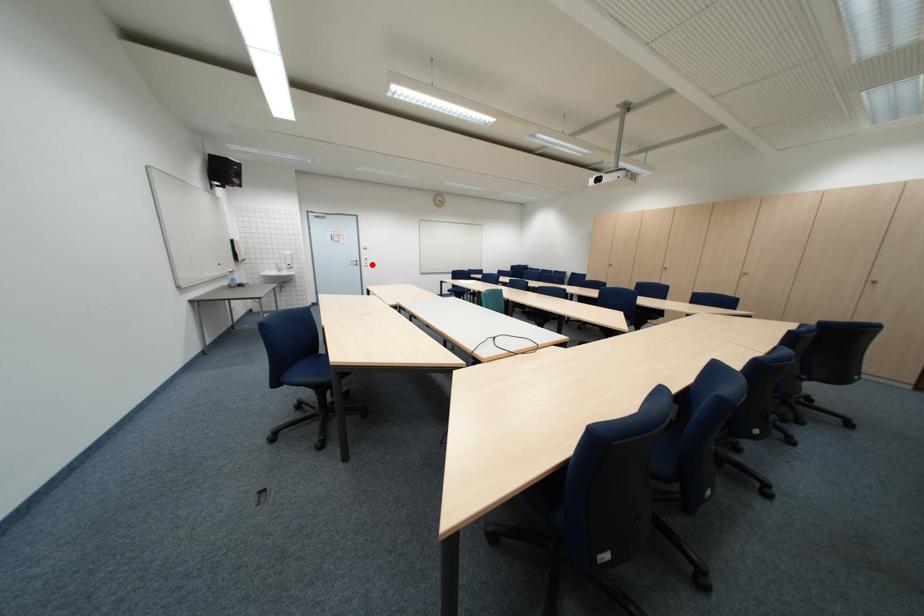
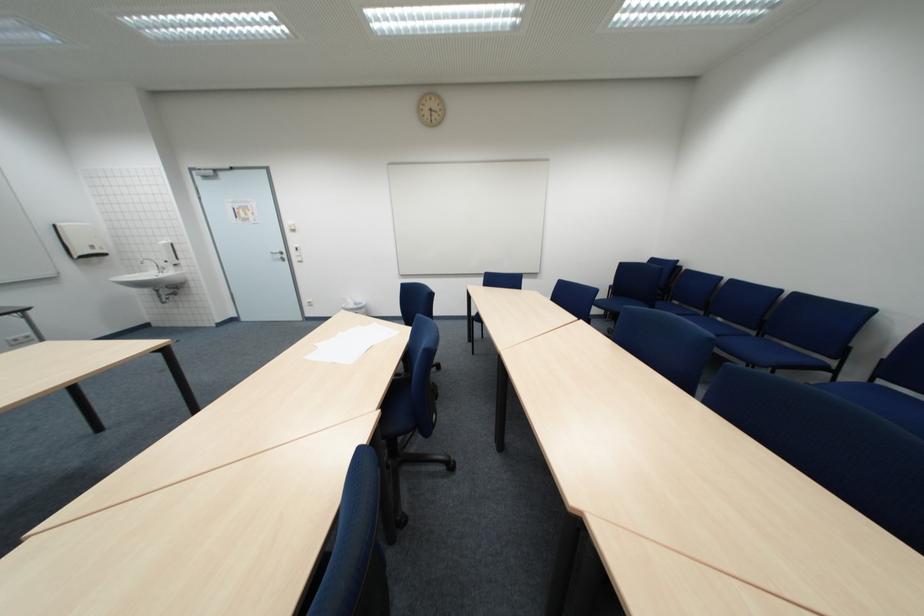
Where in the second image is the point corresponding to the highlighted location from the first image?

(299, 257)